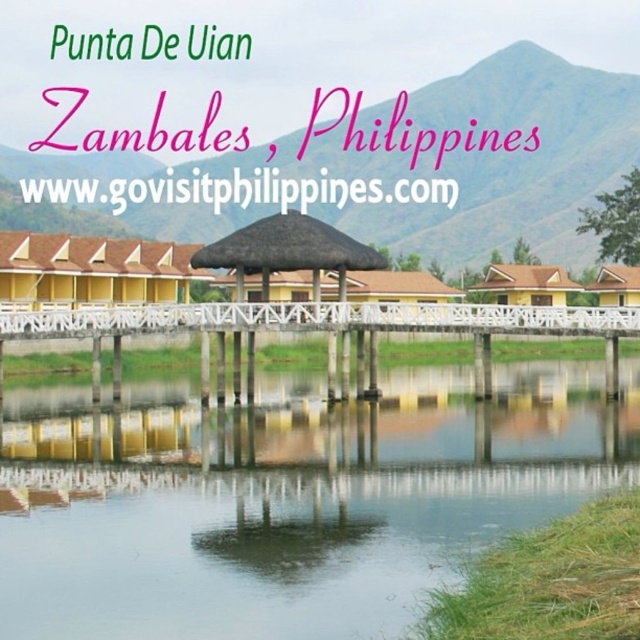
You are a tourist planning to visit Punta De Uian, Zambales, Philippines. You see two yellow huts in the image, the yellow corrugated metal hut at center and the yellow matte hut at lower right. Which one is bigger?

The yellow corrugated metal hut at center is larger in size than the yellow matte hut at lower right.

You are standing on the wooden walkway at Punta De Uian, Zambales, Philippines, and you see the yellow corrugated metal hut at center and the brown thatched roof hut at center. Which one is positioned higher in the image?

The yellow corrugated metal hut at center is located above the brown thatched roof hut at center, so it is positioned higher in the image.